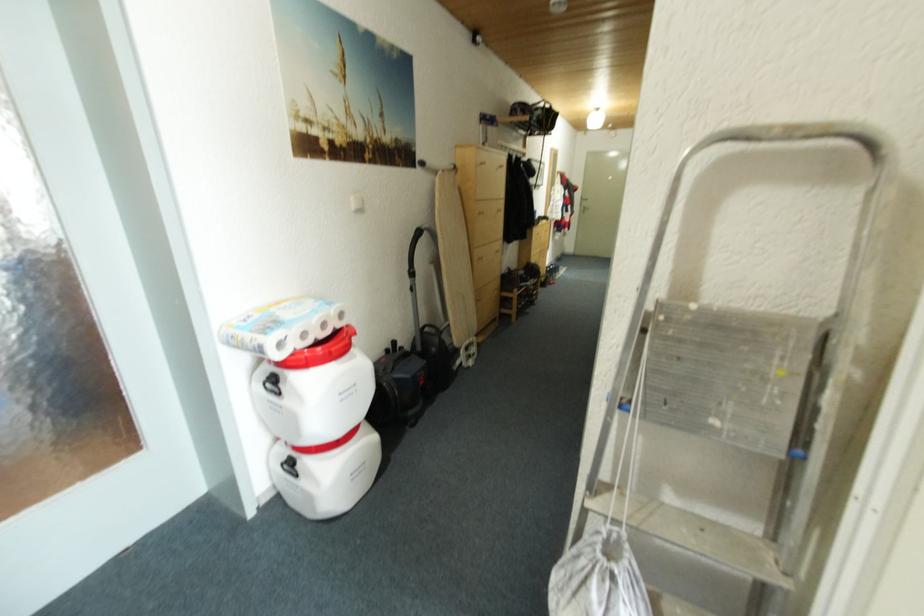
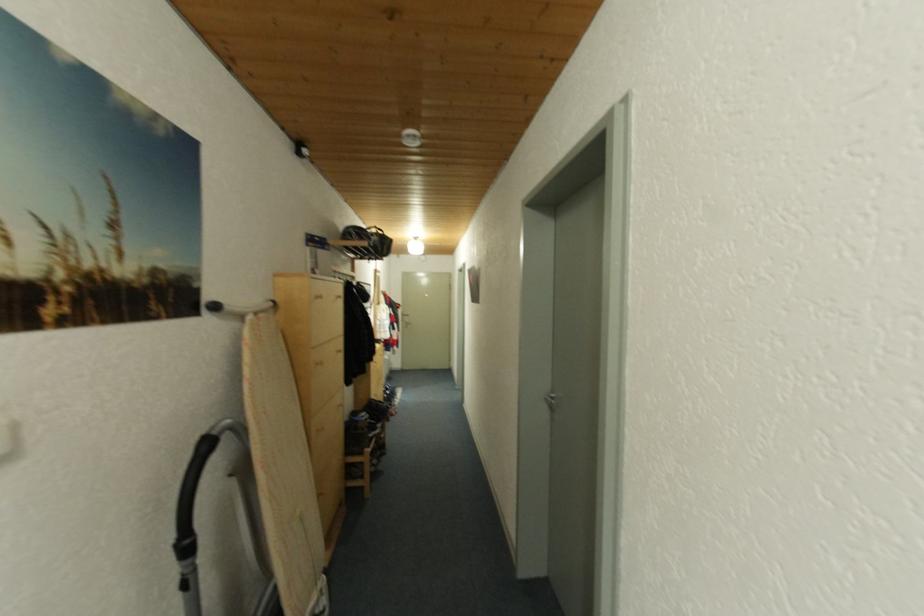
Question: The images are taken continuously from a first-person perspective. In which direction is your viewpoint rotating?

Choices:
 (A) Left
 (B) Right
 (C) Up
 (D) Down

Answer: (B)